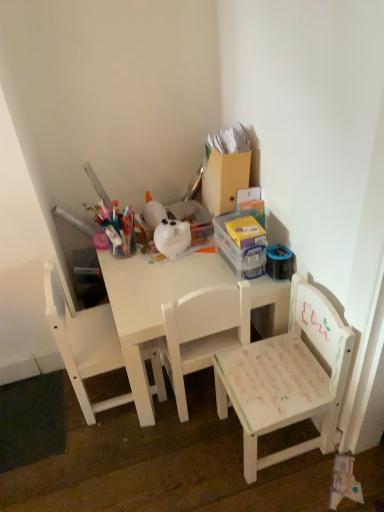
Question: Considering their positions, is white painted wood chair at center, marked as the 2th chair in a right-to-left arrangement, located in front of or behind white matte chair at center, the first chair from the left?

Choices:
 (A) front
 (B) behind

Answer: (A)

Question: In terms of height, does white painted wood chair at center, placed as the second chair when sorted from left to right, look taller or shorter compared to white matte chair at center, which ranks as the third chair in right-to-left order?

Choices:
 (A) short
 (B) tall

Answer: (B)

Question: Considering the real-world distances, which object is farthest from the white painted wood chair at center, placed as the second chair when sorted from left to right?

Choices:
 (A) white matte table at center
 (B) white painted wood chair at lower right, the first chair from the right
 (C) white matte chair at center, the first chair from the left

Answer: (C)

Question: Which object is positioned closest to the white matte table at center?

Choices:
 (A) white painted wood chair at center, placed as the second chair when sorted from left to right
 (B) white matte chair at center, which ranks as the third chair in right-to-left order
 (C) white painted wood chair at lower right, the first chair from the right

Answer: (A)